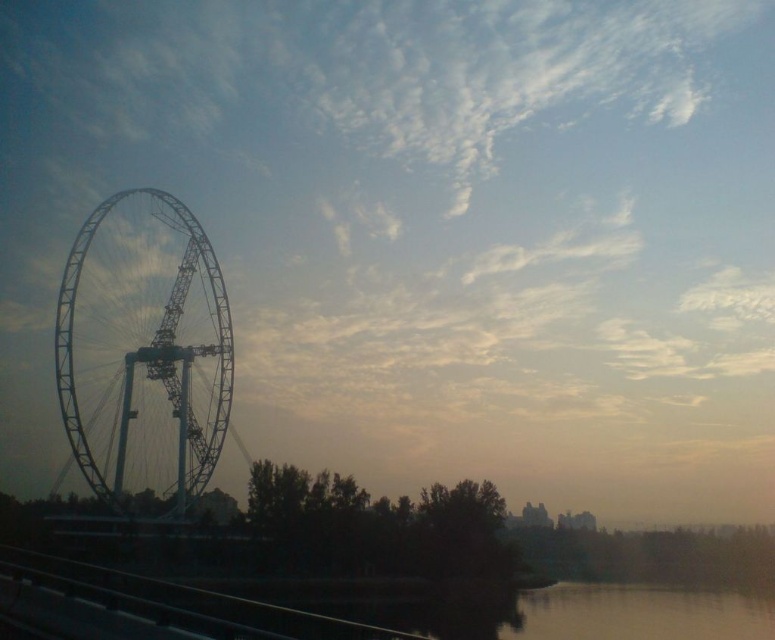
You are standing at the camera position and want to take a photo of the white metallic ferris wheel at left. If your camera has a maximum zoom range of 100 feet, can you capture the entire ferris wheel in one shot without moving closer?

The white metallic ferris wheel at left and camera are 93.88 feet apart from each other. Since the camera can zoom up to 100 feet, you can capture the entire white metallic ferris wheel at left in one shot without moving closer.